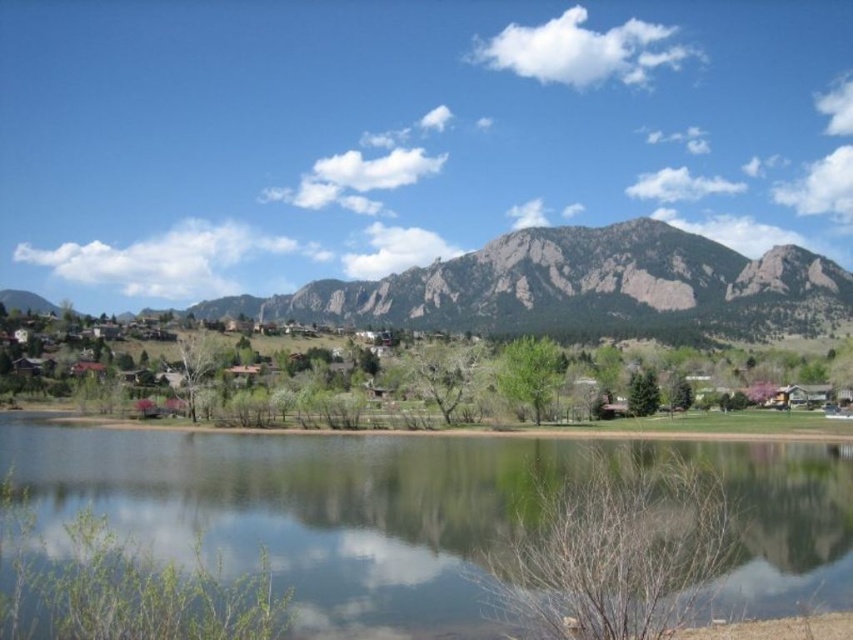
Question: Among these objects, which one is nearest to the camera?

Choices:
 (A) green grassy mountain at center
 (B) clear water at center

Answer: (B)

Question: Does clear water at center come in front of green grassy mountain at center?

Choices:
 (A) yes
 (B) no

Answer: (A)

Question: Is clear water at center thinner than green grassy mountain at center?

Choices:
 (A) yes
 (B) no

Answer: (A)

Question: Which point is farther to the camera?

Choices:
 (A) green grassy mountain at center
 (B) clear water at center

Answer: (A)

Question: Does clear water at center appear over green grassy mountain at center?

Choices:
 (A) no
 (B) yes

Answer: (A)

Question: Which point appears farthest from the camera in this image?

Choices:
 (A) (514, 262)
 (B) (125, 465)

Answer: (A)